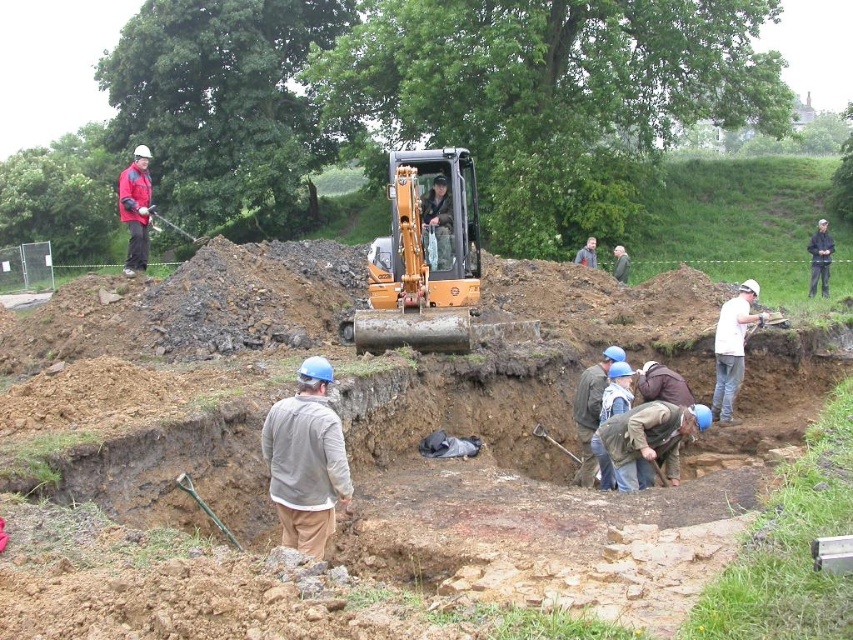
You are an archaeologist at the dig site and need to move the green fabric jacket at center to the right side of the matte yellow excavator at upper center. Is this possible based on their current positions?

The matte yellow excavator at upper center is currently to the left of the green fabric jacket at center. To move the jacket to the right side of the excavator, you would need to position it further to the right relative to the excavator. Since the jacket is already to the right of the excavator, moving it further right would place it even farther away, not next to the excavator. Therefore, it is not possible to place the green fabric jacket at center to the right side of the matte yellow excavator at upper

You are an archaeologist at the dig site and need to hand a tool to the person wearing the gray cotton shirt at center and the white matte helmet at center. Which person should you approach first if you want to give the tool to the one closer to you?

You should approach the gray cotton shirt at center first because it is closer to the viewer than the white matte helmet at center.

You are a photographer standing at the camera position. You want to take a photo of the matte yellow excavator at upper center. The camera has a maximum focus range of 12 feet. Will the excavator be in focus?

The matte yellow excavator at upper center is 13.31 feet away from the camera, which exceeds the maximum focus range of 12 feet. Therefore, the excavator will not be in focus.